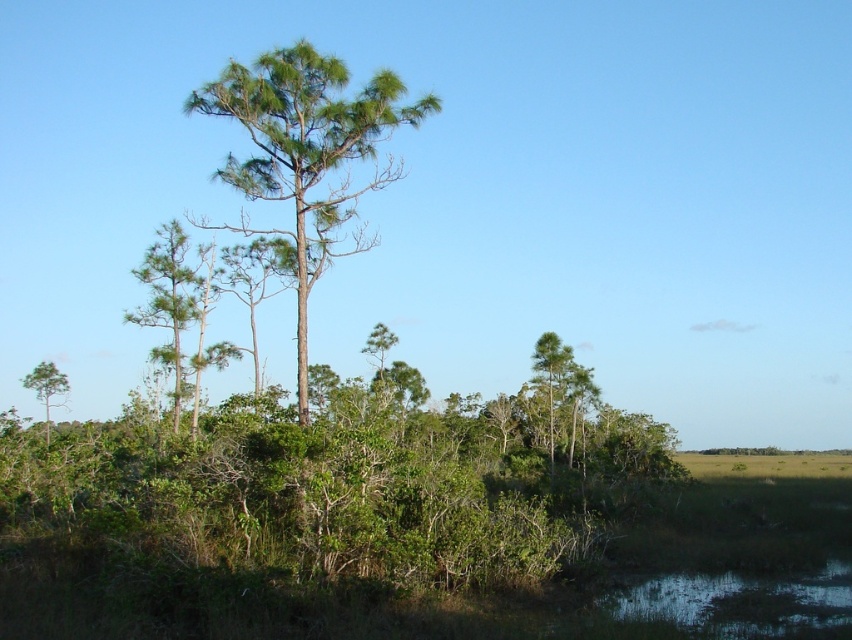
Does greenish reflective water at lower right have a greater height compared to green leafy tree at lower left?

Incorrect, greenish reflective water at lower right's height is not larger of green leafy tree at lower left's.

Can you confirm if greenish reflective water at lower right is positioned below green leafy tree at lower left?

Actually, greenish reflective water at lower right is above green leafy tree at lower left.

Locate an element on the screen. The width and height of the screenshot is (852, 640). greenish reflective water at lower right is located at coordinates (738, 598).

Find the location of a particular element. This screenshot has width=852, height=640. greenish reflective water at lower right is located at coordinates (738, 598).

Which is more to the left, green leafy tree at left or green leafy tree at lower left?

green leafy tree at lower left

Does point (148, 269) come in front of point (33, 374)?

That is True.

Measure the distance between point (x=137, y=268) and camera.

A distance of 179.03 feet exists between point (x=137, y=268) and camera.

The width and height of the screenshot is (852, 640). What are the coordinates of `green leafy tree at left` in the screenshot? It's located at (167, 300).

Which is more to the right, greenish reflective water at lower right or green leafy tree at left?

From the viewer's perspective, greenish reflective water at lower right appears more on the right side.

Is point (743, 595) positioned before point (177, 266)?

That is True.

Find the location of a particular element. greenish reflective water at lower right is located at coordinates (738, 598).